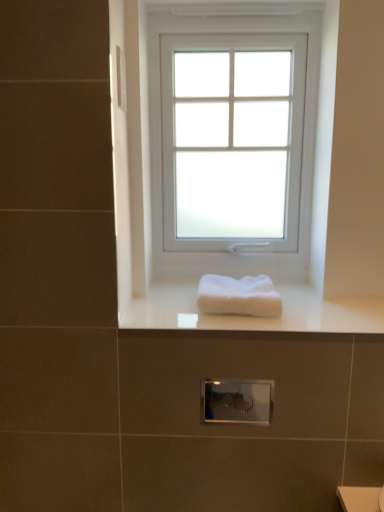
At what (x,y) coordinates should I click in order to perform the action: click on free location to the left of white fluffy towel at center. Please return your answer as a coordinate pair (x, y). Image resolution: width=384 pixels, height=512 pixels. Looking at the image, I should click on (162, 312).